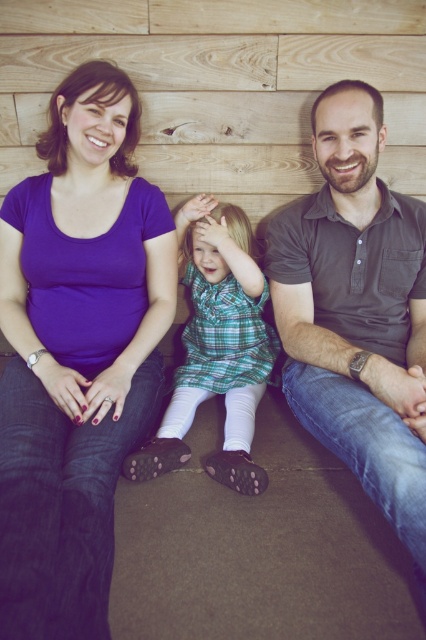
Is purple matte t-shirt at left thinner than green plaid dress at center?

No.

Which is in front, point (43, 218) or point (170, 468)?

Point (170, 468) is more forward.

The width and height of the screenshot is (426, 640). I want to click on purple matte t-shirt at left, so click(x=77, y=353).

Which is in front, point (319, 416) or point (135, 458)?

Point (319, 416) is in front.

Measure the distance between dark gray polo shirt at right and green plaid dress at center.

dark gray polo shirt at right is 9.79 inches away from green plaid dress at center.

The width and height of the screenshot is (426, 640). What are the coordinates of `dark gray polo shirt at right` in the screenshot? It's located at (356, 310).

Is purple matte t-shirt at left above dark gray polo shirt at right?

No.

Who is positioned more to the right, purple matte t-shirt at left or dark gray polo shirt at right?

From the viewer's perspective, dark gray polo shirt at right appears more on the right side.

Is point (149, 385) less distant than point (327, 116)?

No.

This screenshot has height=640, width=426. Identify the location of purple matte t-shirt at left. (77, 353).